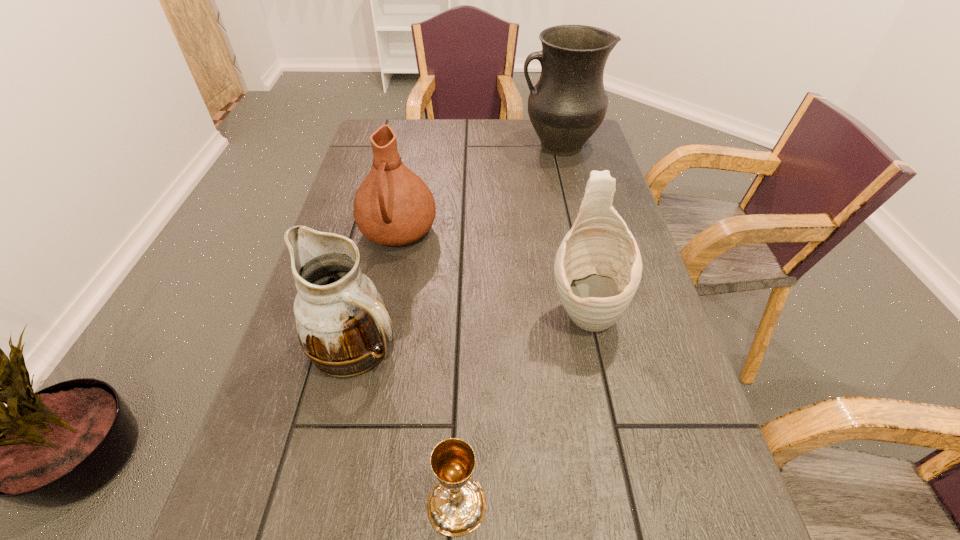
I want to click on object at the far right corner, so click(568, 104).

Find the location of a particular element. The height and width of the screenshot is (540, 960). vacant space at the far edge of the desktop is located at coordinates (442, 133).

At what (x,y) coordinates should I click in order to perform the action: click on vacant space at the left edge. Please return your answer as a coordinate pair (x, y). Looking at the image, I should click on (341, 211).

Find the location of a particular element. The image size is (960, 540). vacant region at the right edge of the desktop is located at coordinates (657, 428).

The width and height of the screenshot is (960, 540). Identify the location of blank area at the far left corner. (388, 120).

The height and width of the screenshot is (540, 960). In order to click on free space between the nearest object and the third nearest pitcher in this screenshot , I will do `click(427, 368)`.

You are a GUI agent. You are given a task and a screenshot of the screen. Output one action in this format:
    pyautogui.click(x=<x>, y=<y>)
    Task: Click on the vacant point located between the second farthest object and the farthest object
    This screenshot has width=960, height=540.
    Given the screenshot: What is the action you would take?
    pyautogui.click(x=478, y=189)

At what (x,y) coordinates should I click in order to perform the action: click on free space between the second farthest pitcher and the chalice. Please return your answer as a coordinate pair (x, y). Looking at the image, I should click on (427, 368).

Locate an element on the screen. The image size is (960, 540). unoccupied position between the farthest pitcher and the second farthest pitcher is located at coordinates (478, 189).

At what (x,y) coordinates should I click in order to perform the action: click on unoccupied position between the farthest object and the shortest object. Please return your answer as a coordinate pair (x, y). This screenshot has width=960, height=540. Looking at the image, I should click on (508, 325).